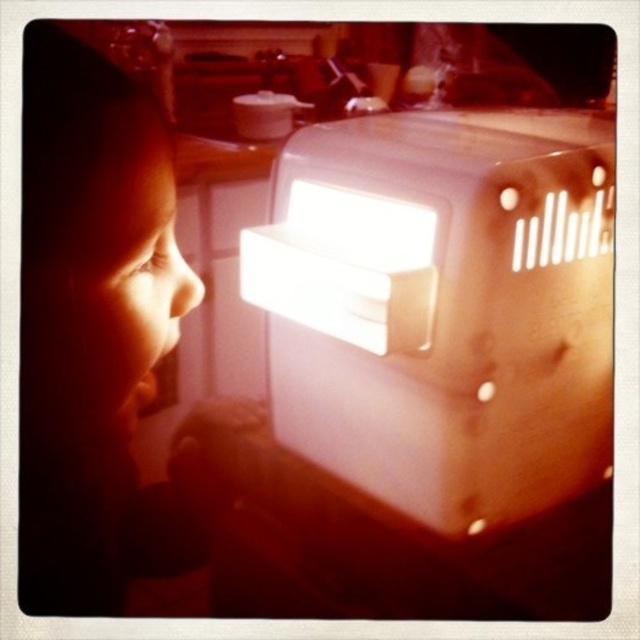
Question: Does white plastic oven at center have a smaller size compared to matte skin child at left?

Choices:
 (A) yes
 (B) no

Answer: (B)

Question: Can you confirm if white plastic oven at center is positioned to the right of matte skin child at left?

Choices:
 (A) yes
 (B) no

Answer: (A)

Question: Does white plastic oven at center have a lesser width compared to matte skin child at left?

Choices:
 (A) yes
 (B) no

Answer: (B)

Question: Among these points, which one is farthest from the camera?

Choices:
 (A) (76, 116)
 (B) (449, 148)

Answer: (B)

Question: Which of the following is the closest to the observer?

Choices:
 (A) white plastic oven at center
 (B) matte skin child at left

Answer: (B)